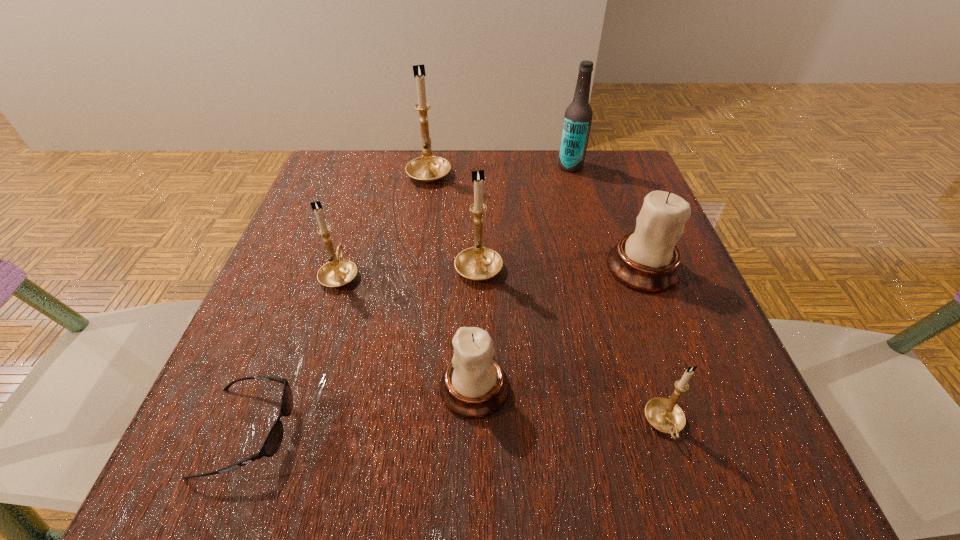
I want to click on the smaller white candle holder, so click(474, 385).

At what (x,y) coordinates should I click in order to perform the action: click on the rightmost gold candle holder. Please return your answer as a coordinate pair (x, y). Looking at the image, I should click on (663, 414).

Find the location of a particular element. This screenshot has width=960, height=540. the smallest gold candle holder is located at coordinates (663, 414).

Locate an element on the screen. This screenshot has height=540, width=960. gray sunglasses is located at coordinates (272, 443).

Find the location of `the shortest object`. the shortest object is located at coordinates (272, 443).

The height and width of the screenshot is (540, 960). Find the location of `vacant space located on the label of the beer bottle`. vacant space located on the label of the beer bottle is located at coordinates (451, 166).

The image size is (960, 540). Identify the location of vacant space situated 0.220m on the label of the beer bottle. (468, 166).

You are a GUI agent. You are given a task and a screenshot of the screen. Output one action in this format:
    pyautogui.click(x=<x>, y=<y>)
    Task: Click on the free space located 0.350m on the label of the beer bottle
    The image size is (960, 540).
    Given the screenshot: What is the action you would take?
    pyautogui.click(x=414, y=166)

At what (x,y) coordinates should I click in order to perform the action: click on blank space located 0.310m on the handle side of the second biggest gold candle holder. Please return your answer as a coordinate pair (x, y). This screenshot has height=540, width=960. Looking at the image, I should click on (479, 163).

Find the location of a particular element. This screenshot has height=540, width=960. vacant area located 0.290m on the handle side of the second biggest gold candle holder is located at coordinates (479, 167).